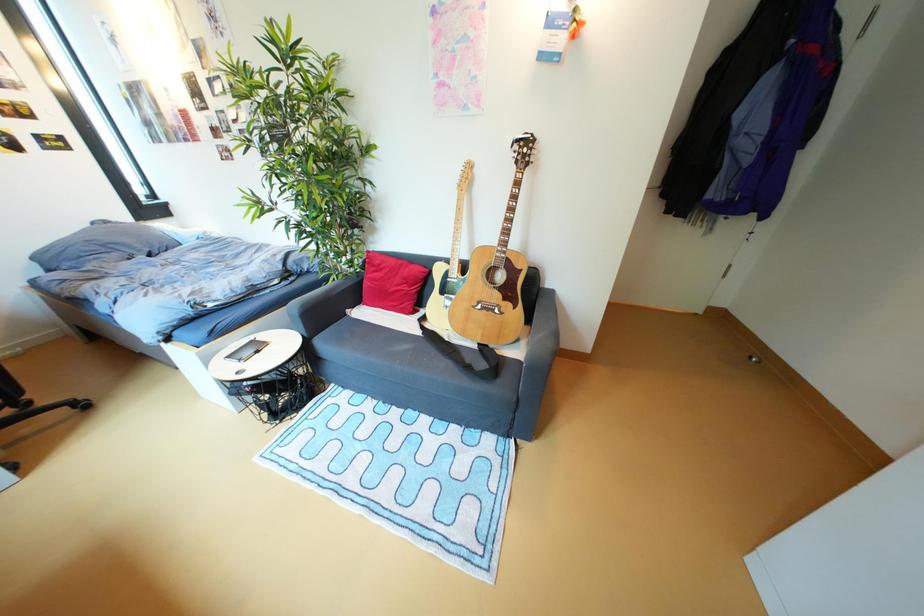
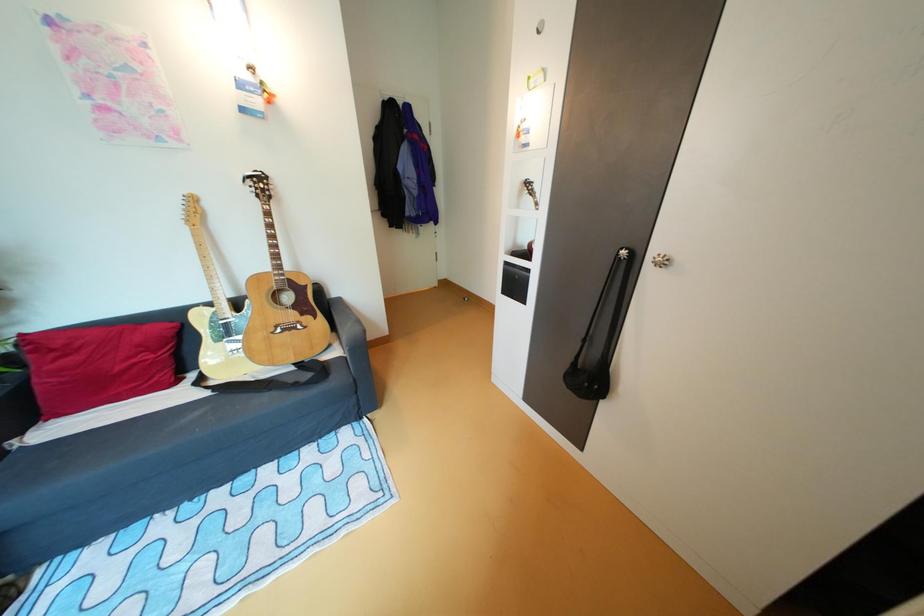
Question: Based on the continuous images, in which direction is the camera rotating? Reply with the corresponding letter.

Choices:
 (A) Left
 (B) Right
 (C) Up
 (D) Down

Answer: (B)